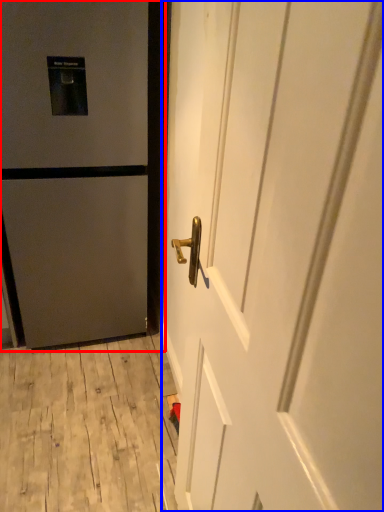
Question: Which point is further to the camera, door (highlighted by a red box) or door (highlighted by a blue box)?

Choices:
 (A) door
 (B) door

Answer: (A)